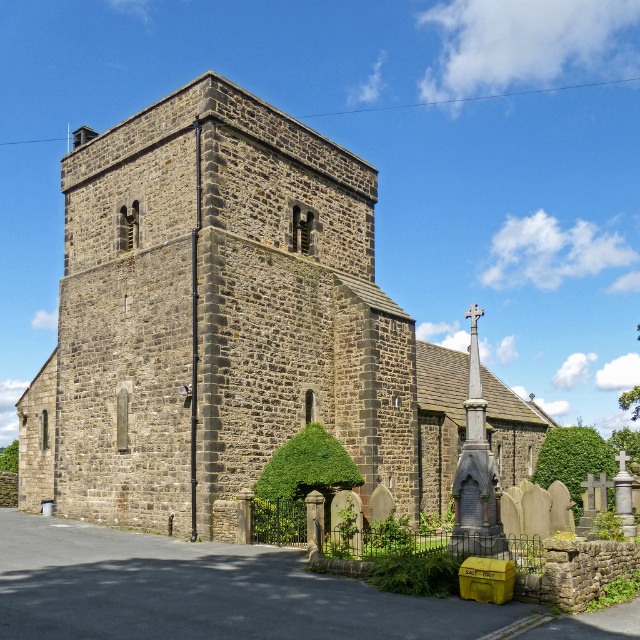
You are standing at point A at point (316, 449) and want to walk to point B which is 42.58 meters away. Is there a direct path between them, or will you have to go around the historic stone church with a robust square shaped tower?

The points are 42.58 meters apart, so you will have to go around the historic stone church with a robust square shaped tower since the distance suggests they are not in direct line of sight.